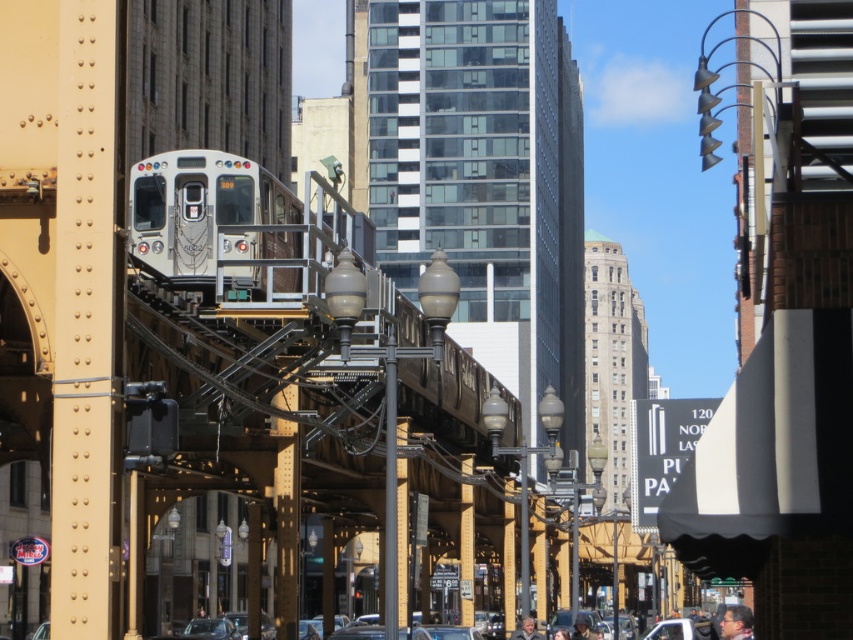
Question: Can you confirm if silver metallic train at center is positioned above metallic silver car at lower center?

Choices:
 (A) yes
 (B) no

Answer: (A)

Question: Does silver metallic train at center come behind metallic silver car at lower center?

Choices:
 (A) yes
 (B) no

Answer: (B)

Question: Is silver metallic train at center above metallic silver car at lower center?

Choices:
 (A) yes
 (B) no

Answer: (A)

Question: Which of the following is the farthest from the observer?

Choices:
 (A) metallic silver car at lower center
 (B) silver metallic train at center

Answer: (A)

Question: Among these objects, which one is farthest from the camera?

Choices:
 (A) metallic silver car at lower center
 (B) silver metallic train at center

Answer: (A)